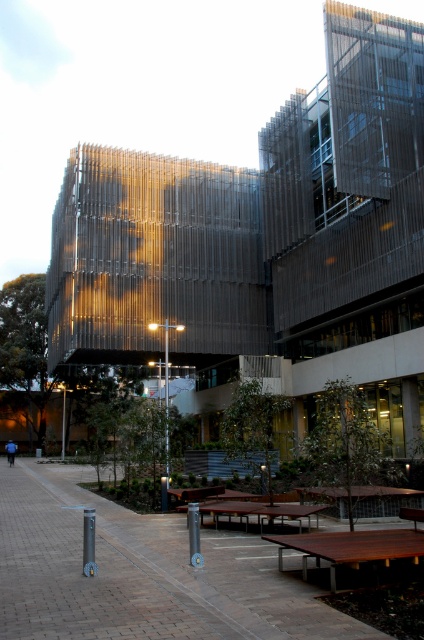
Which is in front, point (282, 548) or point (247, 512)?

Point (282, 548) is in front.

Looking at this image, can you confirm if wooden picnic table at center is shorter than brown wooden bench at center?

In fact, wooden picnic table at center may be taller than brown wooden bench at center.

Is point (404, 538) closer to camera compared to point (214, 513)?

That is True.

You are a GUI agent. You are given a task and a screenshot of the screen. Output one action in this format:
    pyautogui.click(x=<x>, y=<y>)
    Task: Click on the wooden picnic table at center
    The width and height of the screenshot is (424, 640).
    Given the screenshot: What is the action you would take?
    pyautogui.click(x=351, y=547)

Who is more distant from viewer, (x=410, y=554) or (x=413, y=525)?

The point (x=413, y=525) is behind.

Who is more forward, (356, 545) or (413, 525)?

Point (356, 545) is more forward.

Find the location of a particular element. Image resolution: width=424 pixels, height=640 pixels. wooden picnic table at center is located at coordinates (351, 547).

Who is positioned more to the left, brown wooden tables at center or metallic pole at center?

brown wooden tables at center is more to the left.

Is point (167, 628) closer to camera compared to point (166, 330)?

That is True.

Does point (30, 547) come in front of point (164, 394)?

Yes, point (30, 547) is closer to viewer.

This screenshot has width=424, height=640. What are the coordinates of `brown wooden tables at center` in the screenshot? It's located at (141, 573).